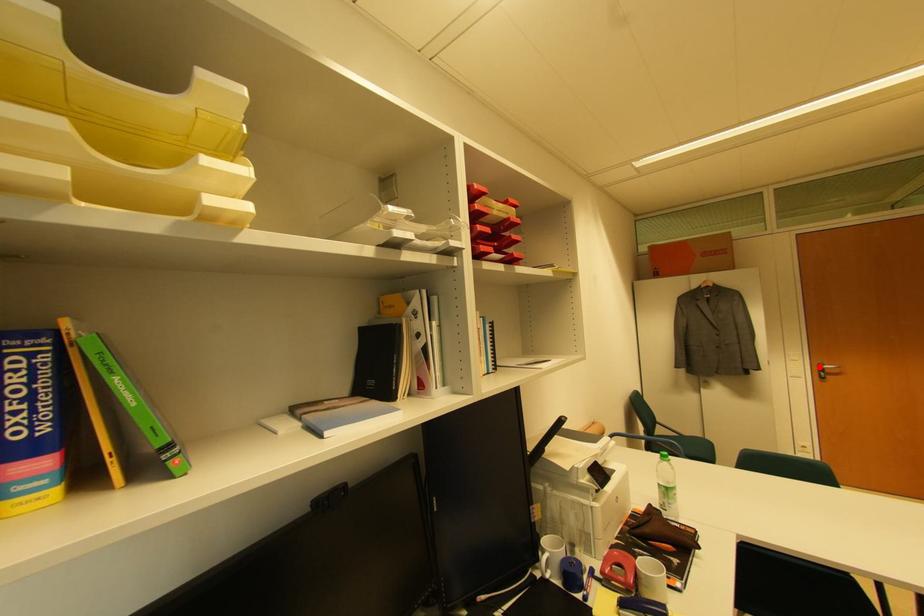
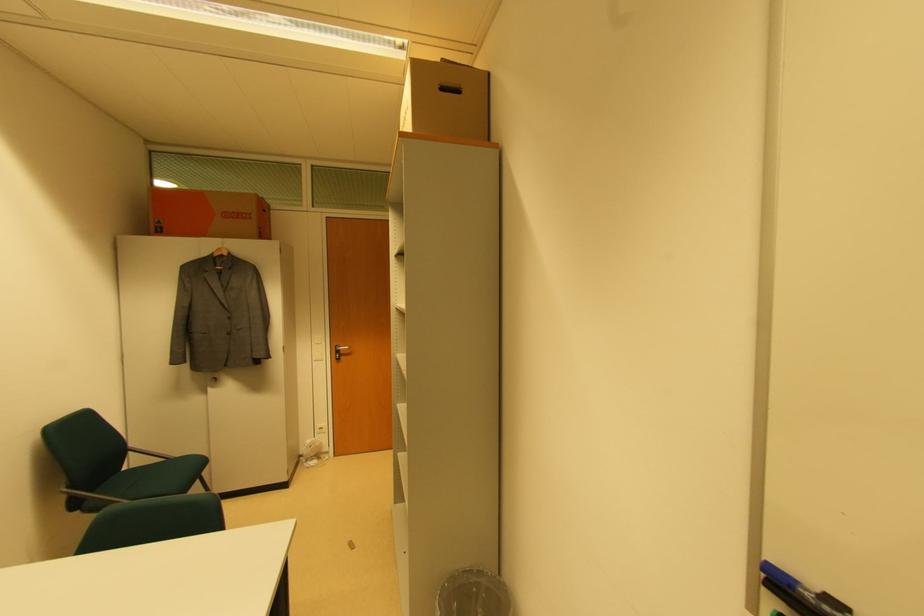
Where in the second image is the point corresponding to the highlighted location from the first image?

(337, 349)